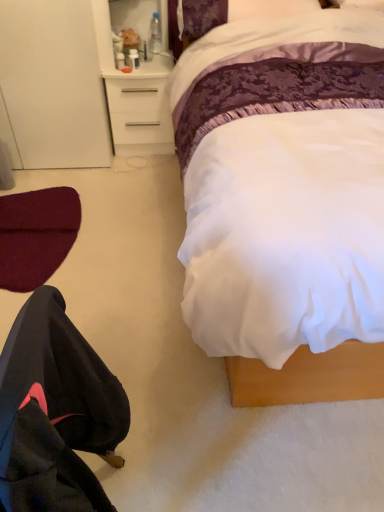
Image resolution: width=384 pixels, height=512 pixels. I want to click on maroon fabric swivel chair at lower left, so click(x=36, y=234).

Image resolution: width=384 pixels, height=512 pixels. Describe the element at coordinates (36, 234) in the screenshot. I see `maroon fabric swivel chair at lower left` at that location.

At what (x,y) coordinates should I click in order to perform the action: click on black fabric robe at lower left. Please return your answer as a coordinate pair (x, y). Image resolution: width=384 pixels, height=512 pixels. Looking at the image, I should click on (55, 412).

The width and height of the screenshot is (384, 512). I want to click on clear plastic bottle at upper center, so click(155, 34).

Considering the relative sizes of white plastic desk at upper center and maroon fabric swivel chair at lower left in the image provided, is white plastic desk at upper center smaller than maroon fabric swivel chair at lower left?

Incorrect, white plastic desk at upper center is not smaller in size than maroon fabric swivel chair at lower left.

From the picture: Is white plastic desk at upper center not inside maroon fabric swivel chair at lower left?

Yes, white plastic desk at upper center is outside of maroon fabric swivel chair at lower left.

Is white plastic desk at upper center positioned with its back to maroon fabric swivel chair at lower left?

No, maroon fabric swivel chair at lower left is not at the back of white plastic desk at upper center.

Is white satin bed at center smaller than maroon fabric swivel chair at lower left?

No, white satin bed at center is not smaller than maroon fabric swivel chair at lower left.

Does point (356, 391) come farther from viewer compared to point (65, 229)?

No, it is in front of (65, 229).

From the picture: Is white satin bed at center at the right side of maroon fabric swivel chair at lower left?

Yes, white satin bed at center is to the right of maroon fabric swivel chair at lower left.

From the picture: Is the position of white satin bed at center less distant than that of maroon fabric swivel chair at lower left?

Yes, it is in front of maroon fabric swivel chair at lower left.

Considering the relative positions of black fabric robe at lower left and maroon fabric swivel chair at lower left in the image provided, is black fabric robe at lower left to the right of maroon fabric swivel chair at lower left from the viewer's perspective?

Yes.

Is black fabric robe at lower left facing towards maroon fabric swivel chair at lower left?

No, black fabric robe at lower left is not turned towards maroon fabric swivel chair at lower left.

From their relative heights in the image, would you say black fabric robe at lower left is taller or shorter than maroon fabric swivel chair at lower left?

Result: In the image, black fabric robe at lower left appears to be taller than maroon fabric swivel chair at lower left.

Is clear plastic bottle at upper center facing away from maroon fabric swivel chair at lower left?

No, maroon fabric swivel chair at lower left is not at the back of clear plastic bottle at upper center.

Is point (156, 14) farther from viewer compared to point (1, 282)?

Yes, it is behind point (1, 282).

Does clear plastic bottle at upper center touch maroon fabric swivel chair at lower left?

No, clear plastic bottle at upper center is not with maroon fabric swivel chair at lower left.

Considering the sizes of objects clear plastic bottle at upper center and black fabric robe at lower left in the image provided, who is bigger, clear plastic bottle at upper center or black fabric robe at lower left?

Bigger between the two is black fabric robe at lower left.

Considering the points (155, 30) and (88, 421), which point is in front, point (155, 30) or point (88, 421)?

Positioned in front is point (88, 421).

Between clear plastic bottle at upper center and black fabric robe at lower left, which one appears on the left side from the viewer's perspective?

From the viewer's perspective, black fabric robe at lower left appears more on the left side.

Considering the relative sizes of clear plastic bottle at upper center and black fabric robe at lower left in the image provided, is clear plastic bottle at upper center shorter than black fabric robe at lower left?

Indeed, clear plastic bottle at upper center has a lesser height compared to black fabric robe at lower left.

Considering the points (48, 410) and (257, 368), which point is in front, point (48, 410) or point (257, 368)?

The point (48, 410) is more forward.

Can you confirm if black fabric robe at lower left is positioned to the right of white satin bed at center?

Incorrect, black fabric robe at lower left is not on the right side of white satin bed at center.

How many degrees apart are the facing directions of black fabric robe at lower left and white satin bed at center?

They differ by 88.3 degrees in their facing directions.

Is black fabric robe at lower left completely or partially outside of white satin bed at center?

That's correct, black fabric robe at lower left is outside of white satin bed at center.

Is black fabric robe at lower left at the back of white satin bed at center?

That's not correct — white satin bed at center is not looking away from black fabric robe at lower left.

Who is smaller, white satin bed at center or black fabric robe at lower left?

black fabric robe at lower left is smaller.

Based on the photo, are white satin bed at center and black fabric robe at lower left beside each other?

No, white satin bed at center is not with black fabric robe at lower left.

From a real-world perspective, which object stands above the other?

white satin bed at center, from a real-world perspective.

I want to click on swivel chair in front of the white plastic desk at upper center, so click(x=36, y=234).

Locate an element on the screen. swivel chair below the white satin bed at center (from the image's perspective) is located at coordinates (36, 234).

Considering their positions, is white satin bed at center positioned closer to black fabric robe at lower left than white plastic desk at upper center?

The object closer to black fabric robe at lower left is white satin bed at center.

Based on their spatial positions, is black fabric robe at lower left or maroon fabric swivel chair at lower left further from white plastic desk at upper center?

black fabric robe at lower left is positioned further to the anchor white plastic desk at upper center.

Based on their spatial positions, is maroon fabric swivel chair at lower left or white satin bed at center closer to black fabric robe at lower left?

white satin bed at center.

Which object lies further to the anchor point white satin bed at center, white plastic desk at upper center or black fabric robe at lower left?

Among the two, white plastic desk at upper center is located further to white satin bed at center.

From the image, which object appears to be nearer to clear plastic bottle at upper center, white satin bed at center or black fabric robe at lower left?

The object closer to clear plastic bottle at upper center is white satin bed at center.

From the image, which object appears to be farther from clear plastic bottle at upper center, maroon fabric swivel chair at lower left or black fabric robe at lower left?

The object further to clear plastic bottle at upper center is black fabric robe at lower left.

Estimate the real-world distances between objects in this image. Which object is further from clear plastic bottle at upper center, white plastic desk at upper center or maroon fabric swivel chair at lower left?

maroon fabric swivel chair at lower left.

When comparing their distances from clear plastic bottle at upper center, does black fabric robe at lower left or white plastic desk at upper center seem further?

black fabric robe at lower left.

The height and width of the screenshot is (512, 384). Identify the location of bed positioned between black fabric robe at lower left and maroon fabric swivel chair at lower left from near to far. (309, 376).

The image size is (384, 512). I want to click on desk between white satin bed at center and clear plastic bottle at upper center in the front-back direction, so click(x=141, y=109).

Where is `swivel chair between black fabric robe at lower left and clear plastic bottle at upper center from front to back`? swivel chair between black fabric robe at lower left and clear plastic bottle at upper center from front to back is located at coordinates 36,234.

The height and width of the screenshot is (512, 384). What are the coordinates of `desk between clear plastic bottle at upper center and maroon fabric swivel chair at lower left from top to bottom` in the screenshot? It's located at (141, 109).